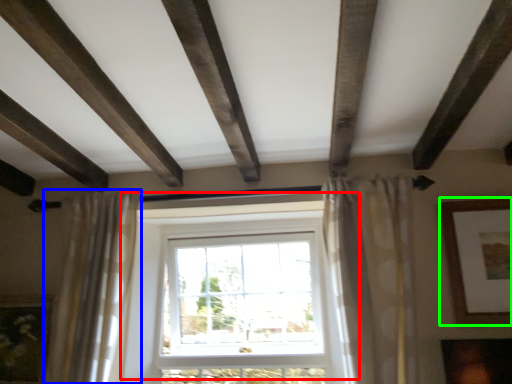
Question: Considering the real-world distances, which object is farthest from window (highlighted by a red box)? curtain (highlighted by a blue box) or picture frame (highlighted by a green box)?

Choices:
 (A) curtain
 (B) picture frame

Answer: (B)